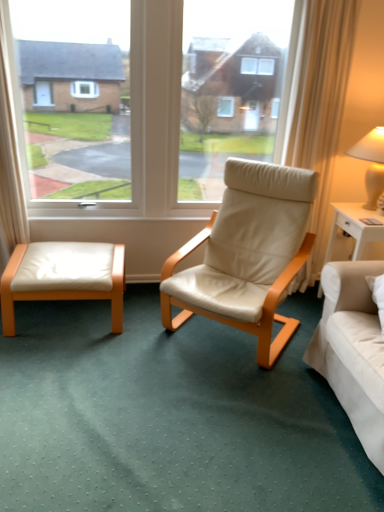
Question: Are beige leather chair at center and white glossy nightstand at right beside each other?

Choices:
 (A) no
 (B) yes

Answer: (A)

Question: From the image's perspective, is beige leather chair at center beneath white glossy nightstand at right?

Choices:
 (A) yes
 (B) no

Answer: (B)

Question: Can you confirm if beige leather chair at center is smaller than white glossy nightstand at right?

Choices:
 (A) yes
 (B) no

Answer: (B)

Question: Does beige leather chair at center have a greater width compared to white glossy nightstand at right?

Choices:
 (A) yes
 (B) no

Answer: (A)

Question: Does beige leather chair at center turn towards white glossy nightstand at right?

Choices:
 (A) yes
 (B) no

Answer: (B)

Question: From a real-world perspective, is beige leather chair at center on top of white glossy nightstand at right?

Choices:
 (A) yes
 (B) no

Answer: (A)

Question: Is white leather ottoman at lower left at the back of matte beige lampshade at upper right?

Choices:
 (A) yes
 (B) no

Answer: (B)

Question: Can white leather ottoman at lower left be found inside matte beige lampshade at upper right?

Choices:
 (A) yes
 (B) no

Answer: (B)

Question: From a real-world perspective, is matte beige lampshade at upper right on white leather ottoman at lower left?

Choices:
 (A) yes
 (B) no

Answer: (A)

Question: Is matte beige lampshade at upper right positioned far away from white leather ottoman at lower left?

Choices:
 (A) no
 (B) yes

Answer: (B)

Question: Is the position of matte beige lampshade at upper right less distant than that of white leather ottoman at lower left?

Choices:
 (A) no
 (B) yes

Answer: (A)

Question: Is the position of matte beige lampshade at upper right more distant than that of white leather ottoman at lower left?

Choices:
 (A) yes
 (B) no

Answer: (A)

Question: From a real-world perspective, is white leather ottoman at lower left on white glossy nightstand at right?

Choices:
 (A) no
 (B) yes

Answer: (A)